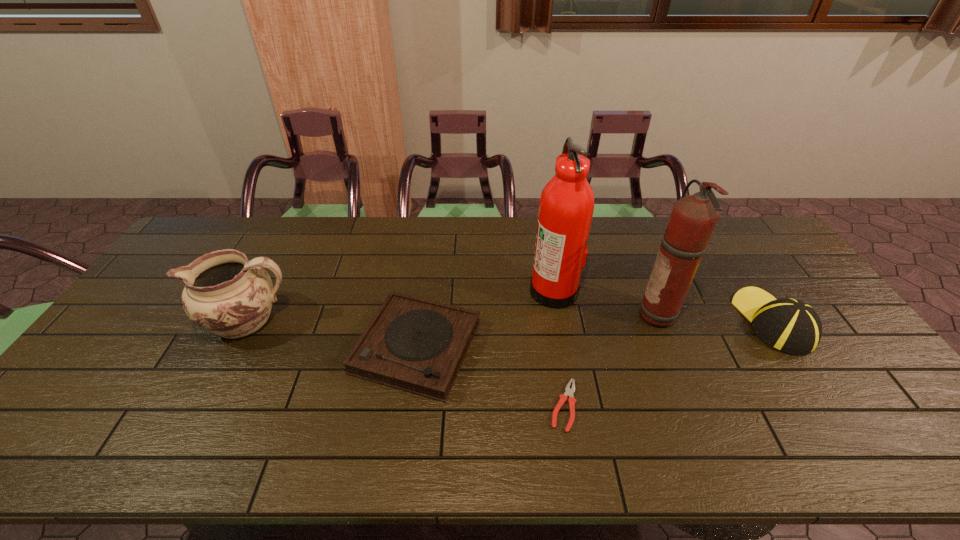
What are the coordinates of `vacant point located on the label side of the left fire extinguisher` in the screenshot? It's located at (417, 289).

At what (x,y) coordinates should I click in order to perform the action: click on vacant point located 0.110m on the label side of the left fire extinguisher. Please return your answer as a coordinate pair (x, y). This screenshot has width=960, height=540. Looking at the image, I should click on (494, 289).

I want to click on blank space located on the side of the second object from right to left with the label and nozzle, so click(x=557, y=315).

At what (x,y) coordinates should I click in order to perform the action: click on blank space located 0.190m on the side of the second object from right to left with the label and nozzle. Please return your answer as a coordinate pair (x, y). Looking at the image, I should click on [x=574, y=315].

I want to click on free space located on the side of the second object from right to left with the label and nozzle, so click(x=540, y=315).

At what (x,y) coordinates should I click in order to perform the action: click on free spot located 0.150m on the spout of the fourth shortest object. Please return your answer as a coordinate pair (x, y). Looking at the image, I should click on (149, 321).

Identify the location of blank space located 0.170m on the spout of the fourth shortest object. (142, 321).

This screenshot has width=960, height=540. Find the location of `free space located on the spout of the fourth shortest object`. free space located on the spout of the fourth shortest object is located at coordinates (153, 321).

Find the location of a particular element. The height and width of the screenshot is (540, 960). free space located with the brim of the fourth tallest object facing forward is located at coordinates (742, 274).

At what (x,y) coordinates should I click in order to perform the action: click on vacant area situated with the brim of the fourth tallest object facing forward. Please return your answer as a coordinate pair (x, y). The width and height of the screenshot is (960, 540). Looking at the image, I should click on (745, 279).